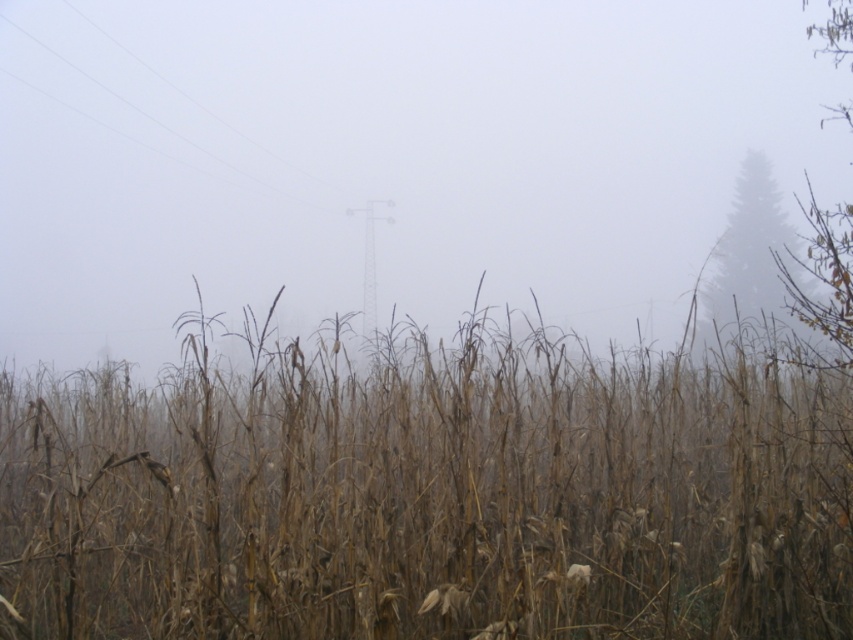
You are an observer in the rural landscape. You notice the foggy atmosphere at center and the green matte tree at upper right. Which object appears taller in the scene?

The foggy atmosphere at center is much taller than the green matte tree at upper right.